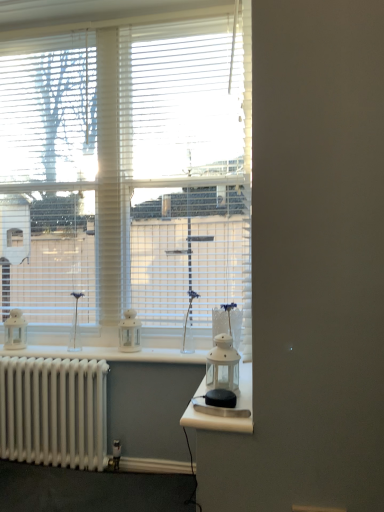
Question: Does white plastic blinds at upper left have a greater width compared to white matte window at center, the first window positioned from the right?

Choices:
 (A) yes
 (B) no

Answer: (B)

Question: Considering the relative sizes of white plastic blinds at upper left and white matte window at center, the first window positioned from the right, in the image provided, is white plastic blinds at upper left taller than white matte window at center, the first window positioned from the right,?

Choices:
 (A) no
 (B) yes

Answer: (A)

Question: Is white plastic blinds at upper left at the left side of white matte window at center, placed as the second window when sorted from left to right?

Choices:
 (A) no
 (B) yes

Answer: (B)

Question: Can you confirm if white plastic blinds at upper left is positioned to the right of white matte window at center, the first window positioned from the right?

Choices:
 (A) no
 (B) yes

Answer: (A)

Question: Considering the relative sizes of white plastic blinds at upper left and white matte window at center, the first window positioned from the right, in the image provided, is white plastic blinds at upper left thinner than white matte window at center, the first window positioned from the right,?

Choices:
 (A) no
 (B) yes

Answer: (B)

Question: Choose the correct answer: Is white glass lantern at center inside white glass lantern at center, the 1th appliance when ordered from front to back, or outside it?

Choices:
 (A) outside
 (B) inside

Answer: (A)

Question: Considering the relative positions of white glass lantern at center and white glass lantern at center, arranged as the 2th appliance when viewed from the back, in the image provided, is white glass lantern at center to the left or to the right of white glass lantern at center, arranged as the 2th appliance when viewed from the back,?

Choices:
 (A) left
 (B) right

Answer: (B)

Question: Looking at the image, does white glass lantern at center seem bigger or smaller compared to white glass lantern at center, which is the second appliance from left to right?

Choices:
 (A) big
 (B) small

Answer: (A)

Question: Is point (251, 431) positioned closer to the camera than point (213, 352)?

Choices:
 (A) closer
 (B) farther

Answer: (A)

Question: From the image's perspective, is white matte window at center, the first window positioned from the right, above or below white matte lantern at center, arranged as the second appliance when viewed from the right?

Choices:
 (A) below
 (B) above

Answer: (B)

Question: Considering the positions of white matte window at center, placed as the second window when sorted from left to right, and white matte lantern at center, arranged as the second appliance when viewed from the right, in the image, is white matte window at center, placed as the second window when sorted from left to right, taller or shorter than white matte lantern at center, arranged as the second appliance when viewed from the right,?

Choices:
 (A) short
 (B) tall

Answer: (B)

Question: Is point (157, 297) positioned closer to the camera than point (132, 332)?

Choices:
 (A) closer
 (B) farther

Answer: (A)

Question: Considering the relative positions of white matte window at center, the first window positioned from the right, and white matte lantern at center, arranged as the second appliance when viewed from the right, in the image provided, is white matte window at center, the first window positioned from the right, to the left or to the right of white matte lantern at center, arranged as the second appliance when viewed from the right,?

Choices:
 (A) right
 (B) left

Answer: (A)

Question: Is white plastic blinds at upper left situated inside white blinds at upper center, marked as the second window in a right-to-left arrangement, or outside?

Choices:
 (A) inside
 (B) outside

Answer: (A)

Question: Is point (23, 119) positioned closer to the camera than point (69, 44)?

Choices:
 (A) closer
 (B) farther

Answer: (B)